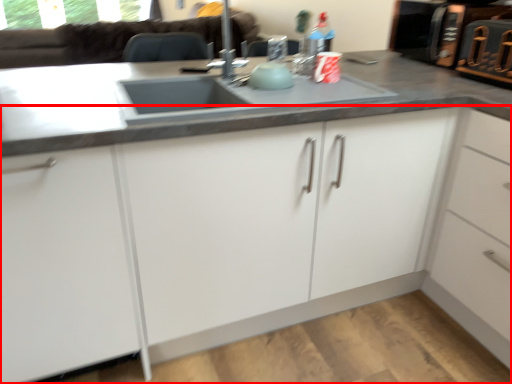
Question: Considering the relative positions of cabinetry (annotated by the red box) and appliance in the image provided, where is cabinetry (annotated by the red box) located with respect to the staircase?

Choices:
 (A) right
 (B) left

Answer: (B)